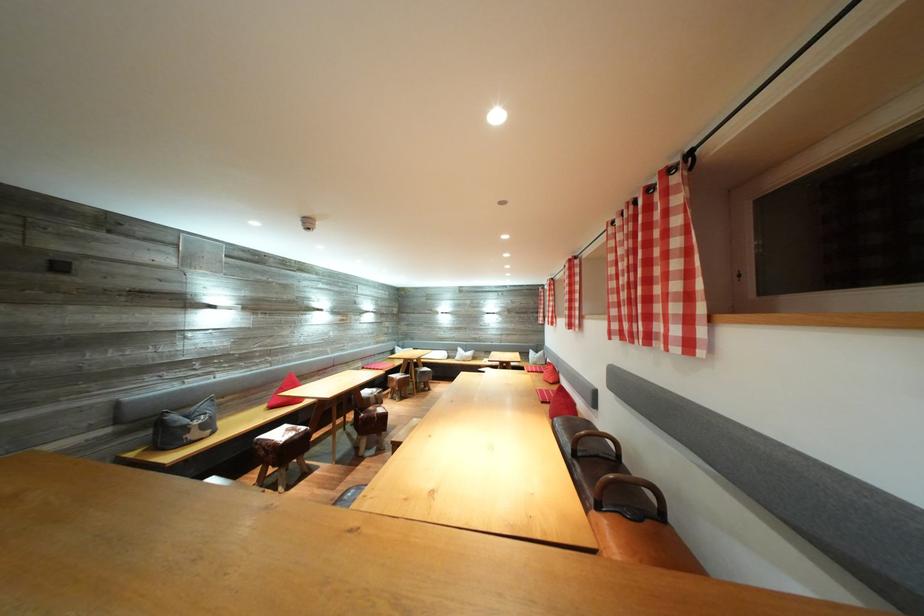
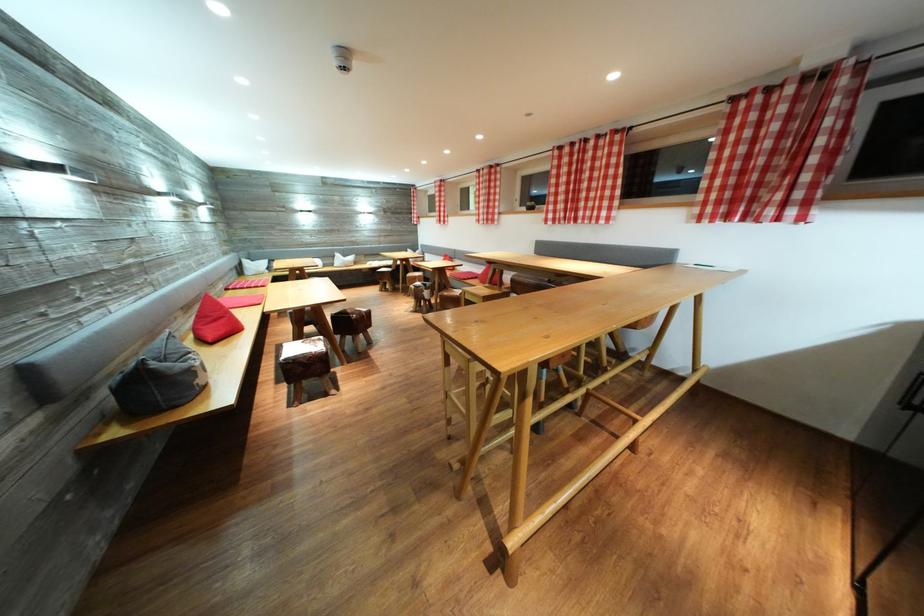
Question: I am providing you with two images of the same scene from different viewpoints. Please identify which objects are invisible in image2.

Choices:
 (A) orange handlebar grip
 (B) chair sitting surface
 (C) red triangular cushion
 (D) red square cushion

Answer: (B)